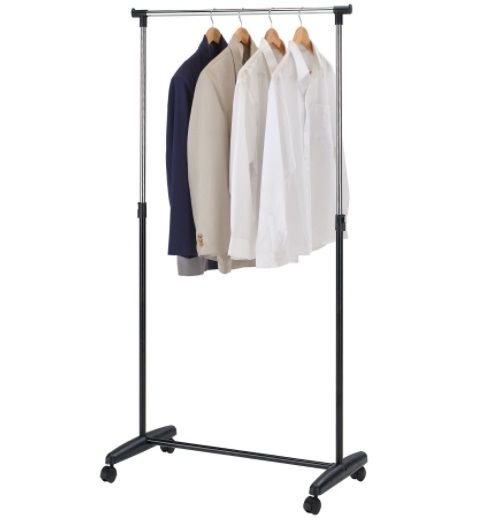
Image resolution: width=491 pixels, height=521 pixels. I want to click on hangers, so 293,29, 272,32, 242,33, 212,36.